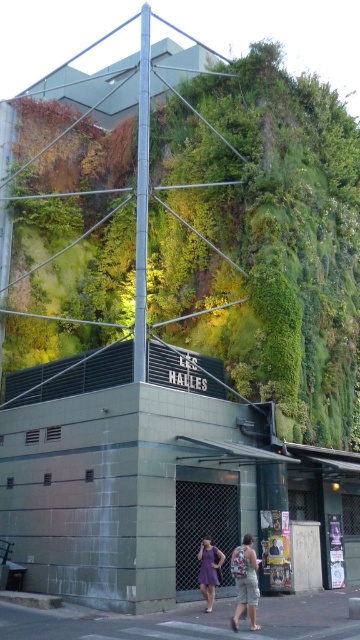
From the picture: You are standing in front of the modern building with the vertical garden. You notice a specific point at coordinates (x=261, y=236). Based on the scene description, what type of surface does this point most likely belong to?

The point at coordinates (x=261, y=236) corresponds to the green mossy wall at upper center, as stated in the objects description.

From the picture: You are standing in front of the building with the vertical garden. You want to take a photo of the point at coordinates point (194, 192). If your camera can focus on objects up to 100 feet away, will it be able to focus on that point?

The distance of point (194, 192) from camera is 100.10 feet, which is slightly beyond the camera focus limit of 100 feet. Therefore, the camera might not be able to focus on that point.